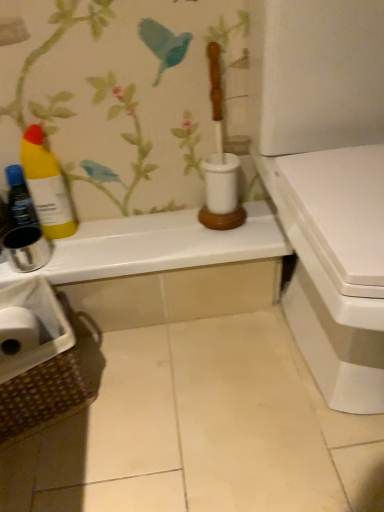
You are a GUI agent. You are given a task and a screenshot of the screen. Output one action in this format:
    pyautogui.click(x=<x>, y=<y>)
    Task: Click on the vacant area located to the right-hand side of yellow matte bottle at left, the 1th bottle viewed from the right
    
    Given the screenshot: What is the action you would take?
    click(124, 232)